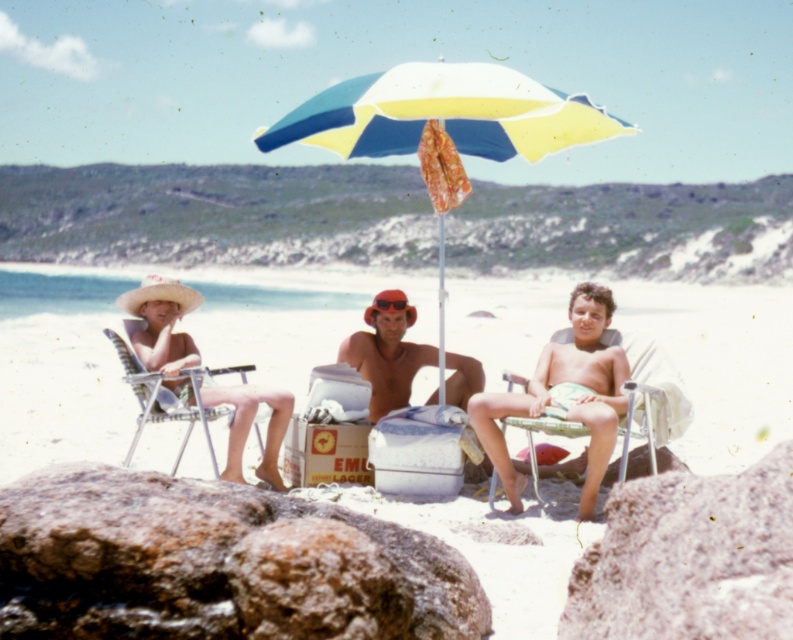
Question: Which object appears farthest from the camera in this image?

Choices:
 (A) yellow and blue striped umbrella at center
 (B) metallic silver beach chair at left
 (C) white sand beach at center

Answer: (B)

Question: Is rusty rock at lower left positioned behind metallic silver beach chair at center?

Choices:
 (A) no
 (B) yes

Answer: (A)

Question: Is yellow and blue striped umbrella at center positioned at the back of metallic silver beach chair at left?

Choices:
 (A) no
 (B) yes

Answer: (A)

Question: Does granite rock at center appear over metallic silver beach chair at center?

Choices:
 (A) yes
 (B) no

Answer: (B)

Question: Which point appears closest to the camera in this image?

Choices:
 (A) (408, 515)
 (B) (213, 374)
 (C) (351, 353)
 (D) (255, 400)

Answer: (A)

Question: Considering the real-world distances, which object is farthest from the white sand beach at center?

Choices:
 (A) rusty rock at lower left
 (B) granite rock at center
 (C) yellow and blue striped umbrella at center
 (D) metallic silver beach chair at center

Answer: (B)